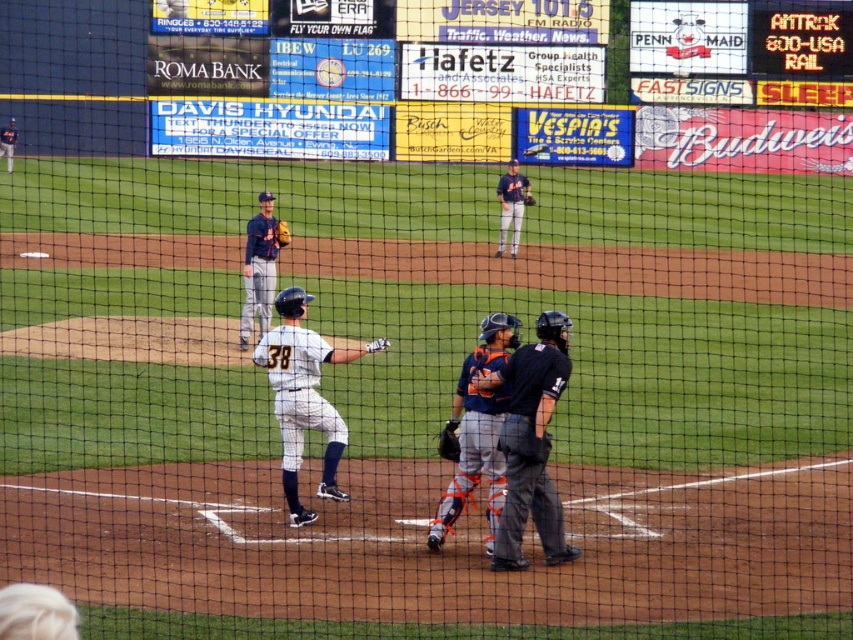
You are a photographer standing at the edge of the field and want to take a photo of the baseball game. You notice two points marked in the image. Which point, point (x=515, y=544) or point (x=517, y=195), is closer to your camera?

Point (x=515, y=544) is closer to the camera than point (x=517, y=195).

You are standing at the center of the baseball field and want to throw a baseball to the point marked at coordinates point (309, 344). If your throwing range is 40 feet, will you be able to reach that point?

The point (309, 344) is 36.71 feet from the viewer, so yes, you can reach it since your throwing range is 40 feet which is greater than 36.71 feet.